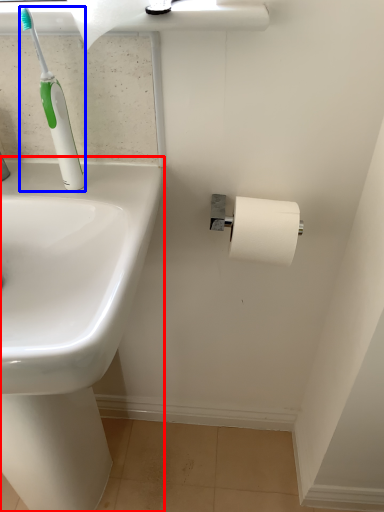
Question: Which object is closer to the camera taking this photo, sink (highlighted by a red box) or toilet brush (highlighted by a blue box)?

Choices:
 (A) sink
 (B) toilet brush

Answer: (A)